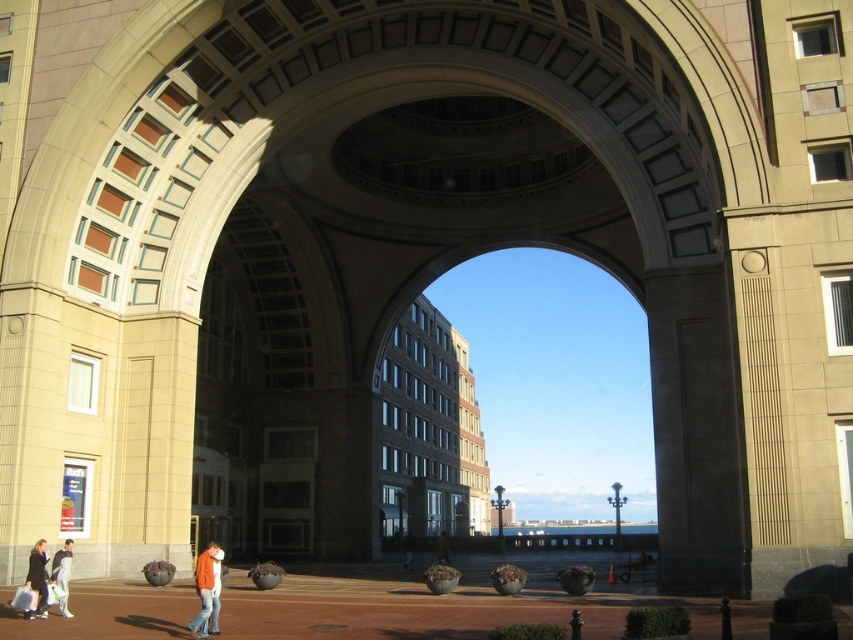
Question: Is black leather jacket at lower left bigger than light brown leather jacket at lower left?

Choices:
 (A) yes
 (B) no

Answer: (A)

Question: Is black leather jacket at lower left further to the viewer compared to light brown leather jacket at lower left?

Choices:
 (A) no
 (B) yes

Answer: (A)

Question: Which object is farther from the camera taking this photo?

Choices:
 (A) orange cotton jacket at lower left
 (B) black leather jacket at lower left

Answer: (B)

Question: Which point appears farthest from the camera in this image?

Choices:
 (A) (68, 552)
 (B) (410, 556)
 (C) (195, 630)
 (D) (440, 554)

Answer: (B)

Question: Which point is farther to the camera?

Choices:
 (A) black leather jacket at lower left
 (B) dark gray jacket at center
 (C) light brown leather jacket at lower left

Answer: (B)

Question: Can you confirm if light brown leather jacket at lower left is smaller than dark brown leather jacket at center?

Choices:
 (A) no
 (B) yes

Answer: (B)